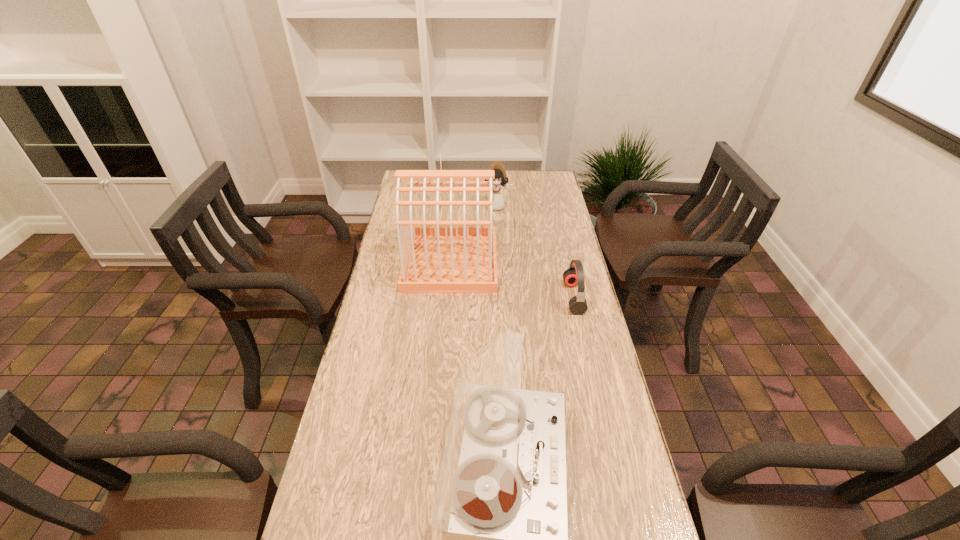
Identify the location of birdcage. (436, 259).

Where is `the farthest object`? the farthest object is located at coordinates (501, 179).

Where is `doll`? Image resolution: width=960 pixels, height=540 pixels. doll is located at coordinates (501, 179).

The height and width of the screenshot is (540, 960). In order to click on earphone in this screenshot , I will do `click(574, 275)`.

At what (x,y) coordinates should I click in order to perform the action: click on the rightmost object. Please return your answer as a coordinate pair (x, y). The height and width of the screenshot is (540, 960). Looking at the image, I should click on (574, 275).

The image size is (960, 540). Find the location of `free point located 0.310m with an open door on the birdcage`. free point located 0.310m with an open door on the birdcage is located at coordinates (580, 262).

Find the location of a particular element. Image resolution: width=960 pixels, height=540 pixels. vacant space located 0.180m at the front face of the third tallest object is located at coordinates (497, 237).

You are a GUI agent. You are given a task and a screenshot of the screen. Output one action in this format:
    pyautogui.click(x=<x>, y=<y>)
    Task: Click on the vacant region located 0.130m on the ear cups of the rightmost object
    
    Given the screenshot: What is the action you would take?
    pyautogui.click(x=526, y=298)

Locate an element on the screen. The image size is (960, 540). free location located on the ear cups of the rightmost object is located at coordinates (517, 298).

Locate an element on the screen. This screenshot has height=540, width=960. vacant region located 0.100m on the ear cups of the rightmost object is located at coordinates (536, 298).